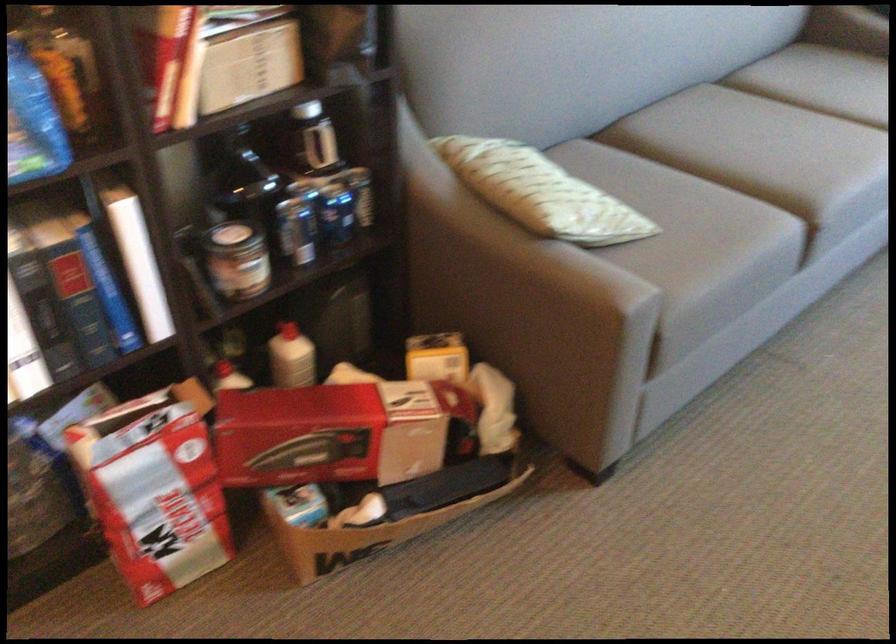
Find where to sit the grey sofa sitting surface. Please return your answer as a coordinate pair (x, y).

(760, 147)